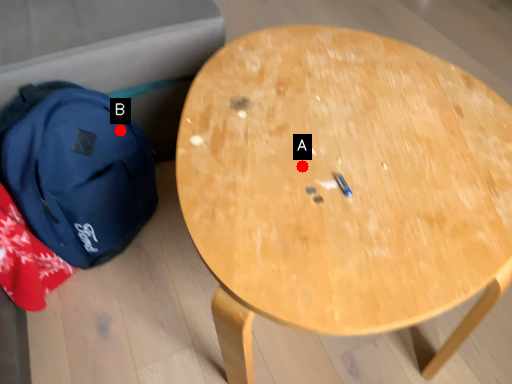
Question: Two points are circled on the image, labeled by A and B beside each circle. Among these points, which one is farthest from the camera?

Choices:
 (A) A is further
 (B) B is further

Answer: (B)